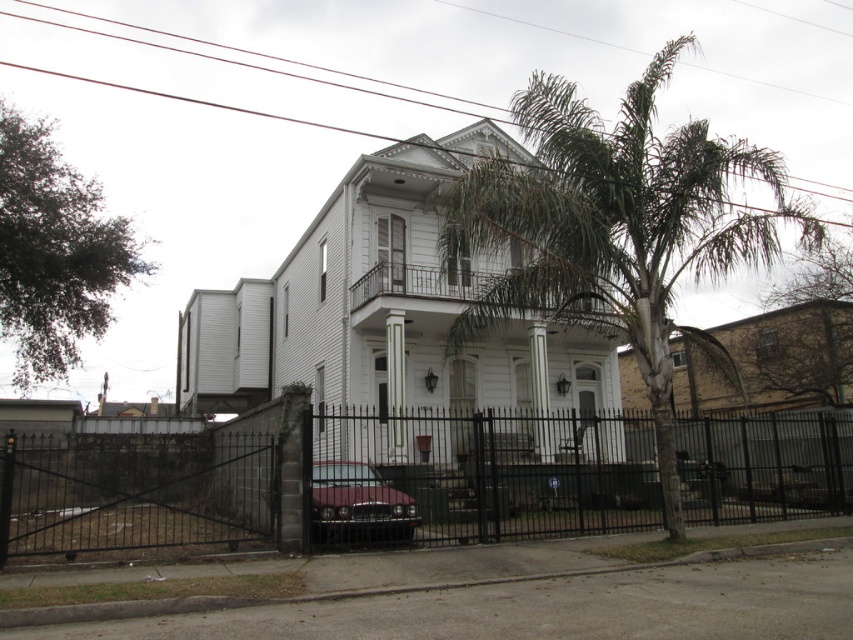
Question: Which object is farther from the camera taking this photo?

Choices:
 (A) black metal fence at center
 (B) green leafy palm tree at center
 (C) shiny maroon car at center

Answer: (C)

Question: Based on their relative distances, which object is nearer to the shiny maroon car at center?

Choices:
 (A) black metal fence at center
 (B) green leafy palm tree at center

Answer: (A)

Question: Is black metal fence at center closer to camera compared to green leafy palm tree at center?

Choices:
 (A) no
 (B) yes

Answer: (B)

Question: In this image, where is black metal fence at center located relative to shiny maroon car at center?

Choices:
 (A) below
 (B) above

Answer: (A)

Question: Can you confirm if black metal fence at center is wider than shiny maroon car at center?

Choices:
 (A) yes
 (B) no

Answer: (A)

Question: Which of the following is the closest to the observer?

Choices:
 (A) green leafy palm tree at center
 (B) shiny maroon car at center

Answer: (A)